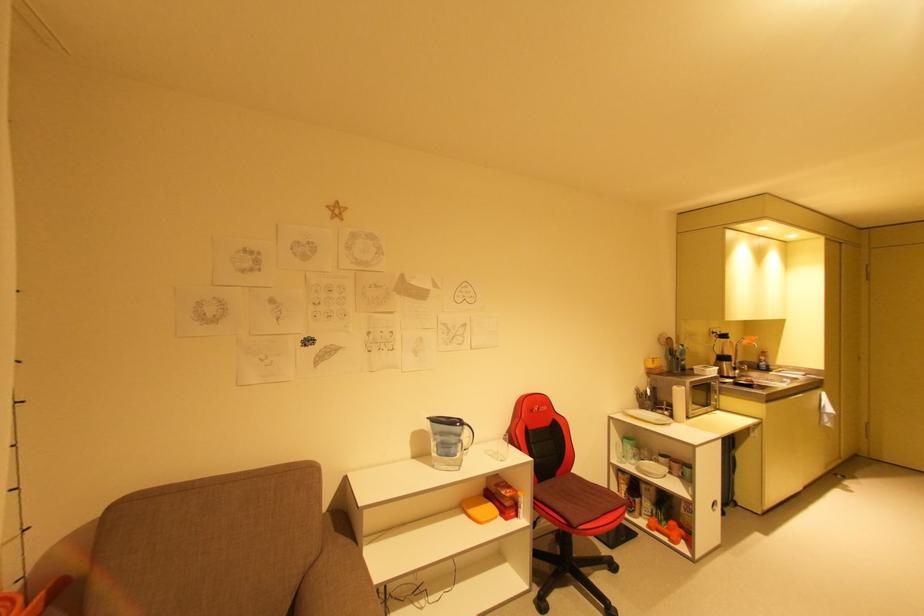
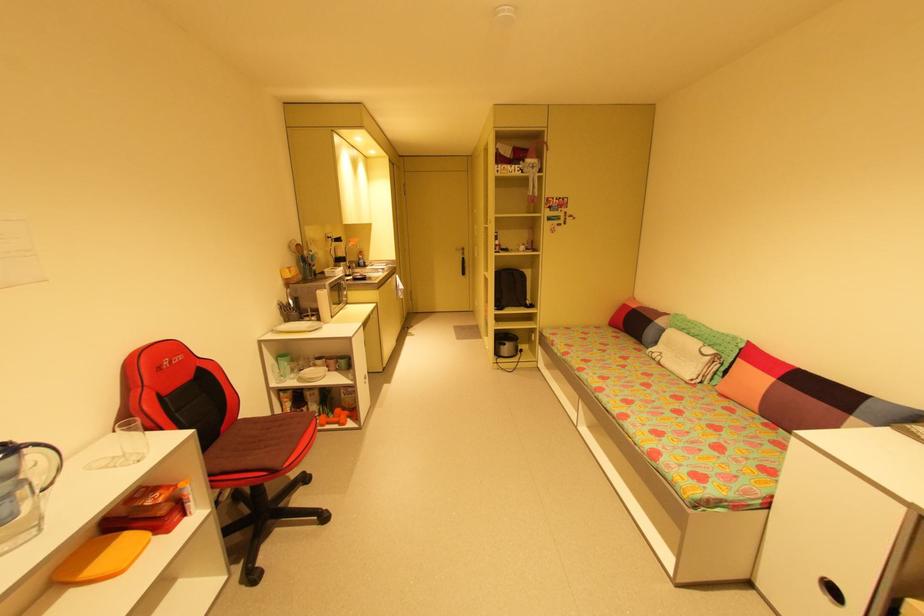
The point at (469, 427) is marked in the first image. Where is the corresponding point in the second image?

(30, 450)